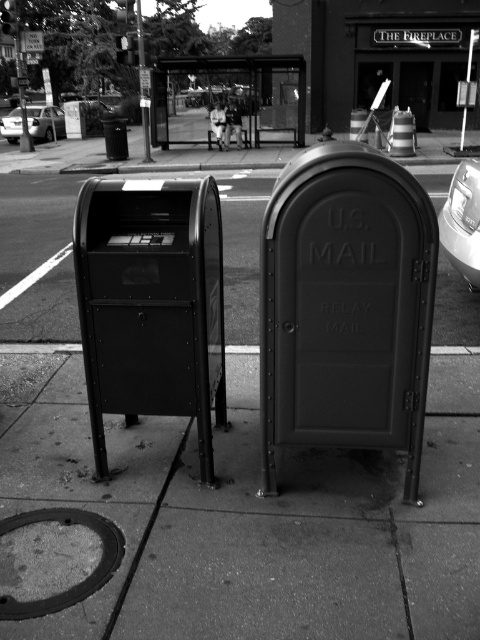
You are a delivery person who needs to park your metallic silver sedan at left as close as possible to the matte black mailbox at left without blocking the sidewalk. The sidewalk has a width of 5 feet. Can you park your car close enough to the mailbox while staying within the sidewalk?

→ The distance between the matte black mailbox at left and the metallic silver sedan at left is 77.73 feet. Since the sidewalk is only 5 feet wide, the car cannot be parked on the sidewalk. Therefore, you must park the metallic silver sedan at left in a designated parking area away from the sidewalk to avoid blocking pedestrian pathways.

You are a mail carrier driving a metallic silver sedan at left and need to access the matte black mailbox at left to deliver mail. Is the mailbox currently accessible for you to use?

The matte black mailbox at left is positioned under the metallic silver sedan at left, which means the sedan is blocking access to the mailbox. You will need to move the sedan to access it.